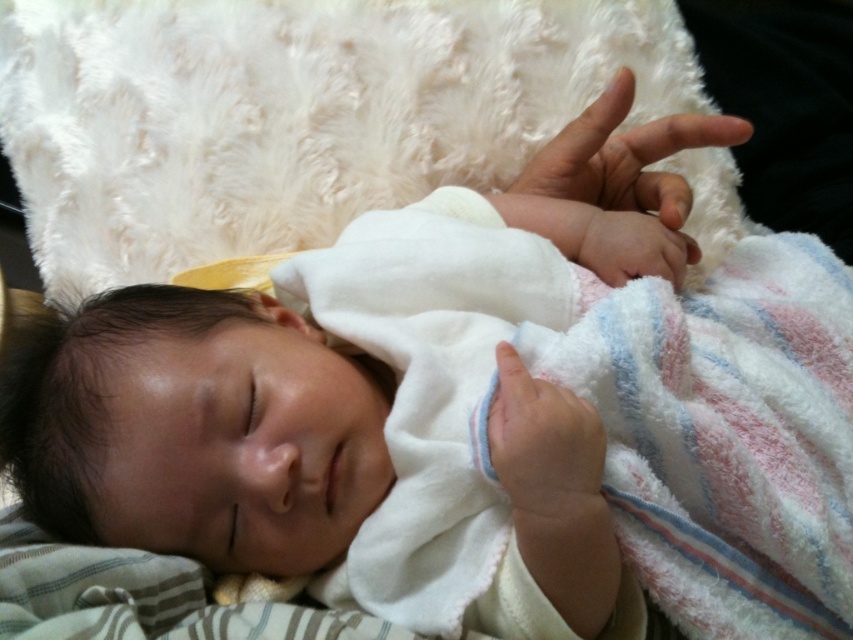
Question: Is pink soft skin at center bigger than smooth white hand at center?

Choices:
 (A) no
 (B) yes

Answer: (B)

Question: Which object appears farthest from the camera in this image?

Choices:
 (A) smooth white hand at center
 (B) pink soft skin at center

Answer: (B)

Question: Can you confirm if pink soft skin at center is wider than smooth white hand at center?

Choices:
 (A) yes
 (B) no

Answer: (A)

Question: Which point is closer to the camera?

Choices:
 (A) pink soft skin at center
 (B) smooth white hand at center

Answer: (B)

Question: Does pink soft skin at center have a greater width compared to smooth white hand at center?

Choices:
 (A) yes
 (B) no

Answer: (A)